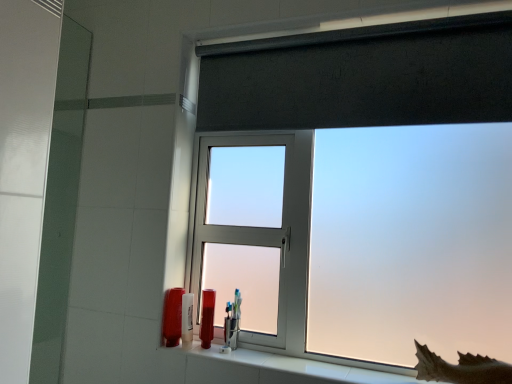
What are the coordinates of `free space to the right of translucent plastic toothbrush at lower center, which appears as the third toiletry when viewed from the right` in the screenshot? It's located at [222, 346].